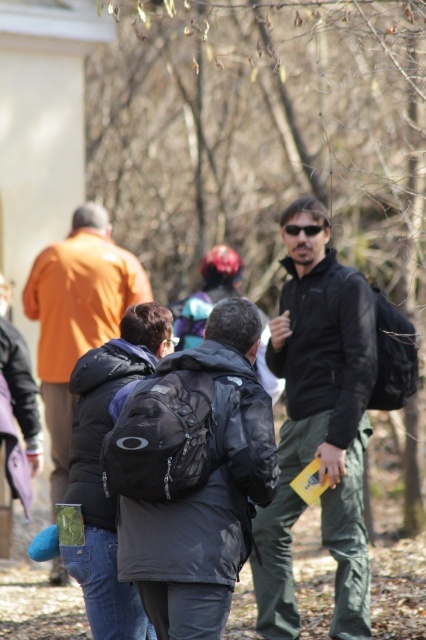
You are part of a hiking group in the woods. You notice two jackets in the scene. The black matte jacket at center and the orange matte jacket at left. Which jacket is positioned lower in the image?

The black matte jacket at center is located below the orange matte jacket at left, so it is positioned lower in the image.